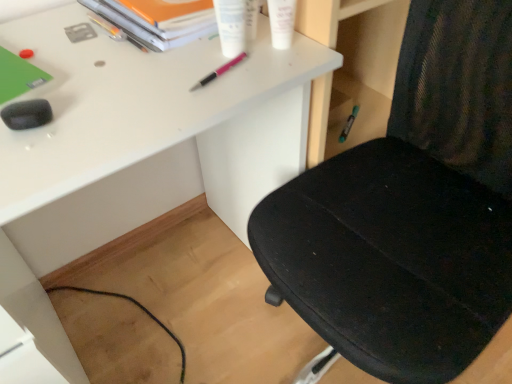
Image resolution: width=512 pixels, height=384 pixels. Find the location of `vacant space in between pink metallic pen at upper center, the 4th stationery when ordered from right to left, and matte black earbuds at left, the first stationery when ordered from left to right`. vacant space in between pink metallic pen at upper center, the 4th stationery when ordered from right to left, and matte black earbuds at left, the first stationery when ordered from left to right is located at coordinates (130, 90).